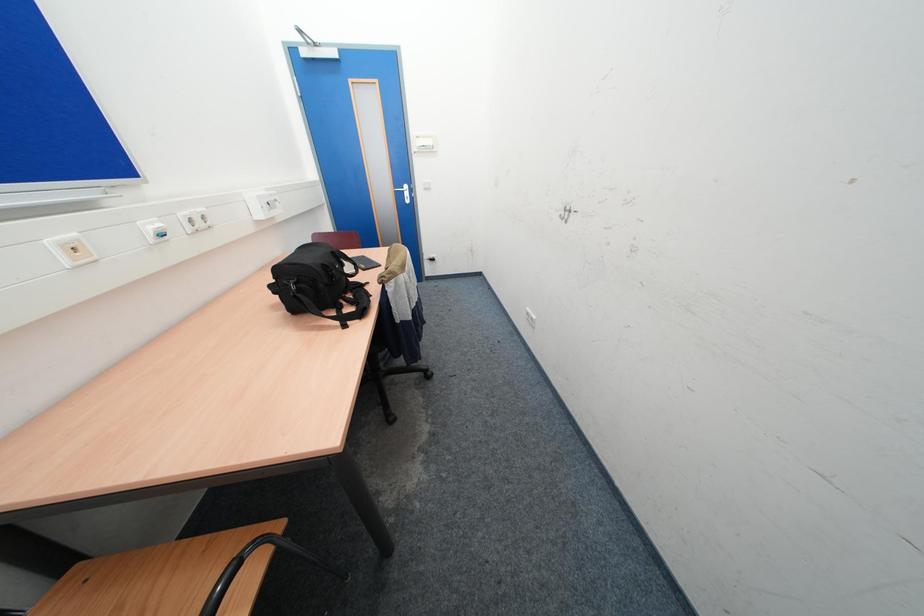
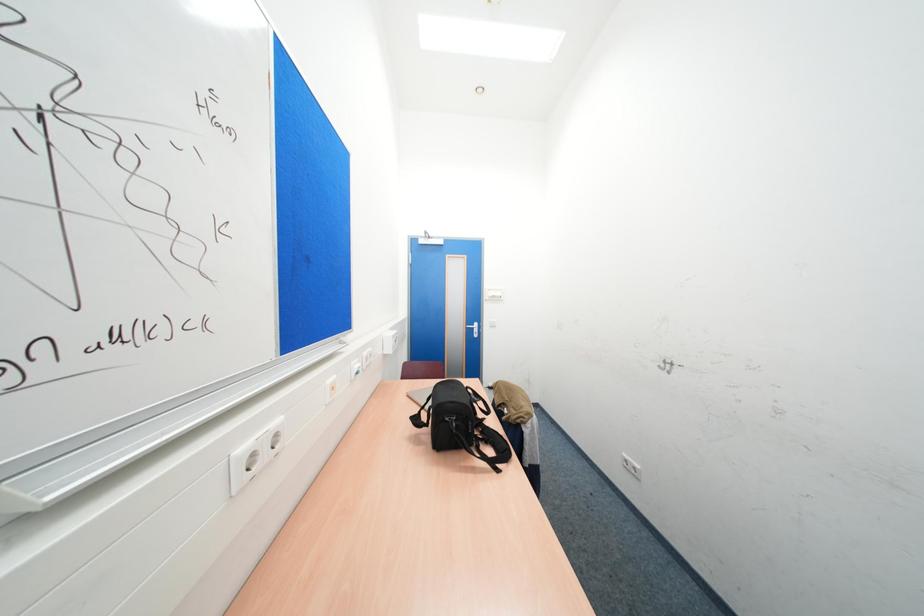
In a continuous first-person perspective shot, in which direction is the camera moving?

The movement direction of the cameraman is left, backward.